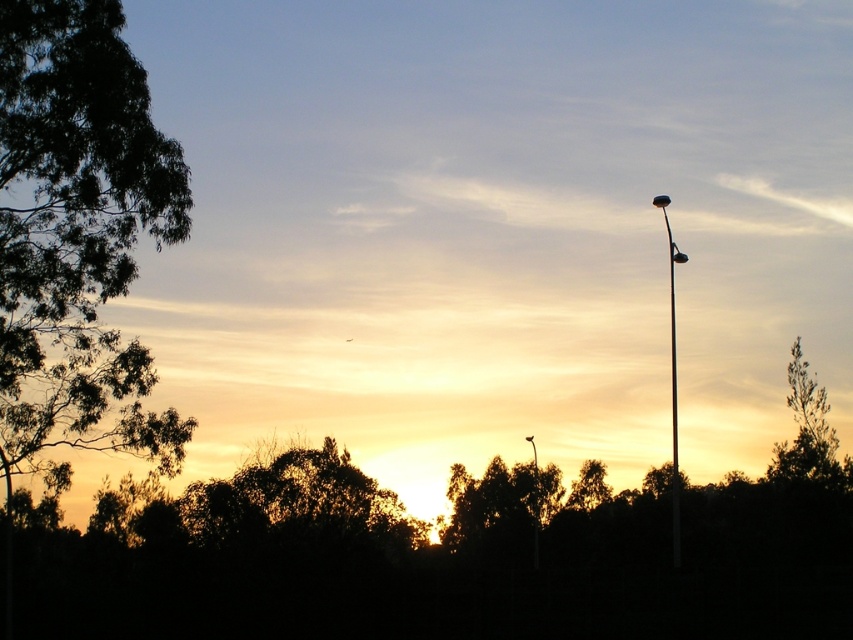
Based on the photo, between green leafy tree at right and metallic pole at right, which one is positioned higher?

Positioned higher is metallic pole at right.

Can you confirm if green leafy tree at right is positioned below metallic pole at right?

Yes.

Is point (846, 467) behind point (679, 547)?

Yes, it is behind point (679, 547).

Find the location of `green leafy tree at right`. green leafy tree at right is located at coordinates (808, 433).

Is green leafy tree at left above metallic pole at right?

Yes.

Who is more forward, (173, 164) or (669, 285)?

Point (173, 164)

Between point (36, 131) and point (672, 417), which one is positioned behind?

The point (672, 417) is more distant.

Image resolution: width=853 pixels, height=640 pixels. What are the coordinates of `green leafy tree at left` in the screenshot? It's located at click(77, 230).

Between green leafy tree at left and green leafy tree at right, which one appears on the right side from the viewer's perspective?

green leafy tree at right is more to the right.

Find the location of a particular element. Image resolution: width=853 pixels, height=640 pixels. green leafy tree at left is located at coordinates (77, 230).

The height and width of the screenshot is (640, 853). In order to click on green leafy tree at left in this screenshot , I will do `click(77, 230)`.